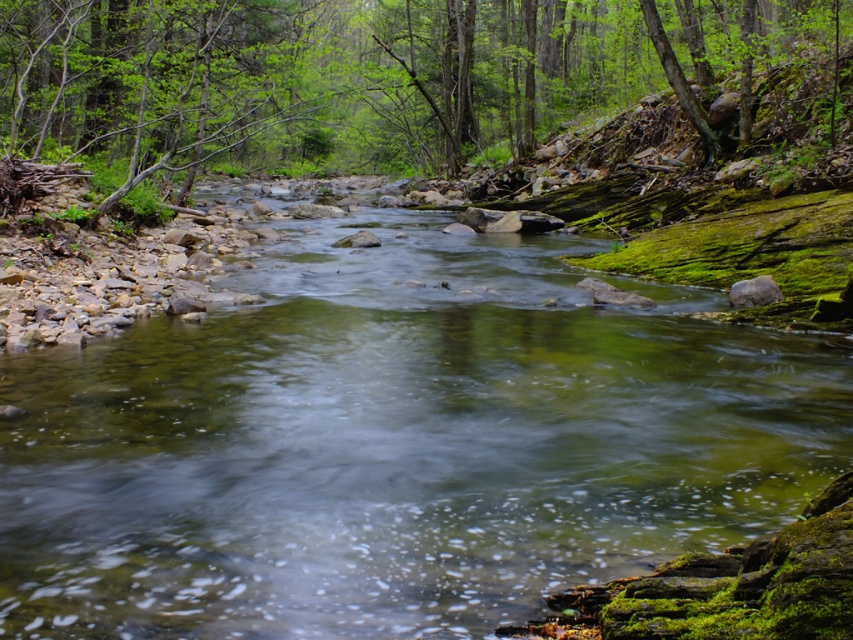
In the scene shown: Can you confirm if clear water at center is bigger than green leafy tree at upper center?

No, clear water at center is not bigger than green leafy tree at upper center.

Which is more to the right, clear water at center or green leafy tree at upper center?

From the viewer's perspective, clear water at center appears more on the right side.

Measure the distance between clear water at center and camera.

A distance of 9.04 feet exists between clear water at center and camera.

The image size is (853, 640). Identify the location of clear water at center. (397, 442).